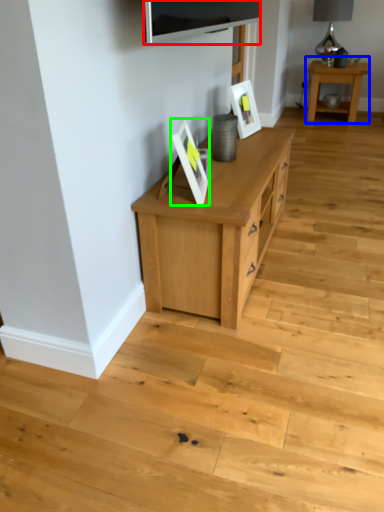
Question: Based on their relative distances, which object is nearer to television (highlighted by a red box)? Choose from table (highlighted by a blue box) and picture frame (highlighted by a green box).

Choices:
 (A) table
 (B) picture frame

Answer: (B)